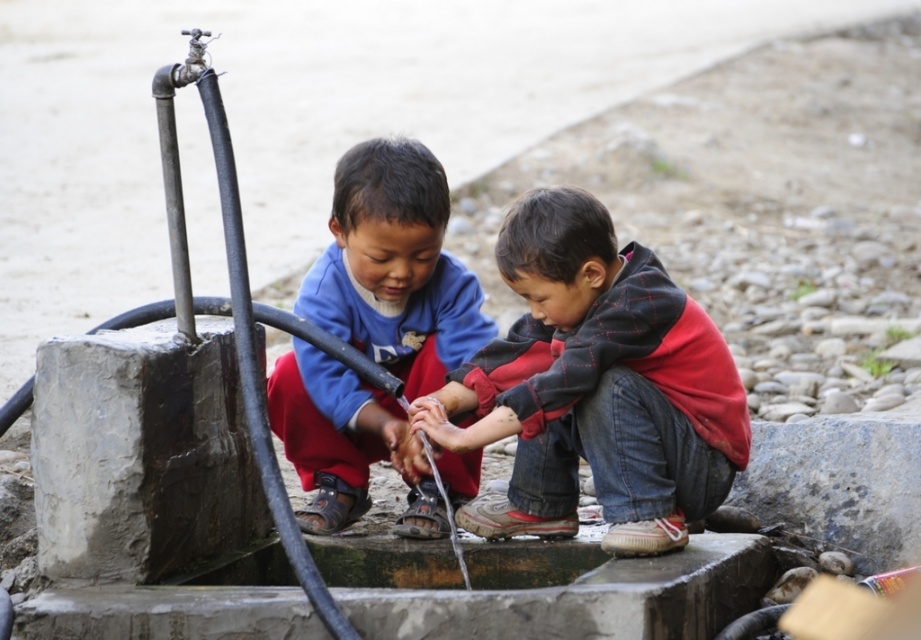
You are a photographer trying to capture both children in a single shot. Given that your camera frame can only accommodate objects up to the width of the red plaid hoodie at center, will the blue fleece jacket at center fit entirely within the frame?

The red plaid hoodie at center is wider than the blue fleece jacket at center. Since the camera frame can fit the red plaid hoodie at center, the blue fleece jacket at center will also fit entirely within the frame.

You are a photographer taking a picture of the two children at the water fountain. Which child should you focus on first if you want to capture the one wearing the red plaid hoodie at center and the blue fleece jacket at center in the same frame?

You should focus on the blue fleece jacket at center first because the red plaid hoodie at center is positioned under it, so adjusting focus to the upper layer ensures both are in frame.